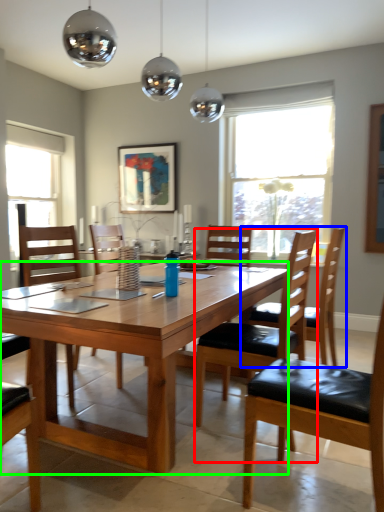
Question: Based on their relative distances, which object is nearer to chair (highlighted by a red box)? Choose from chair (highlighted by a blue box) and desk (highlighted by a green box).

Choices:
 (A) chair
 (B) desk

Answer: (B)